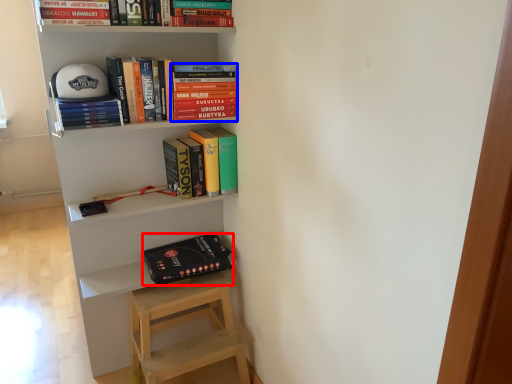
Question: Which object appears farthest to the camera in this image, paperback book (highlighted by a red box) or book (highlighted by a blue box)?

Choices:
 (A) paperback book
 (B) book

Answer: (A)